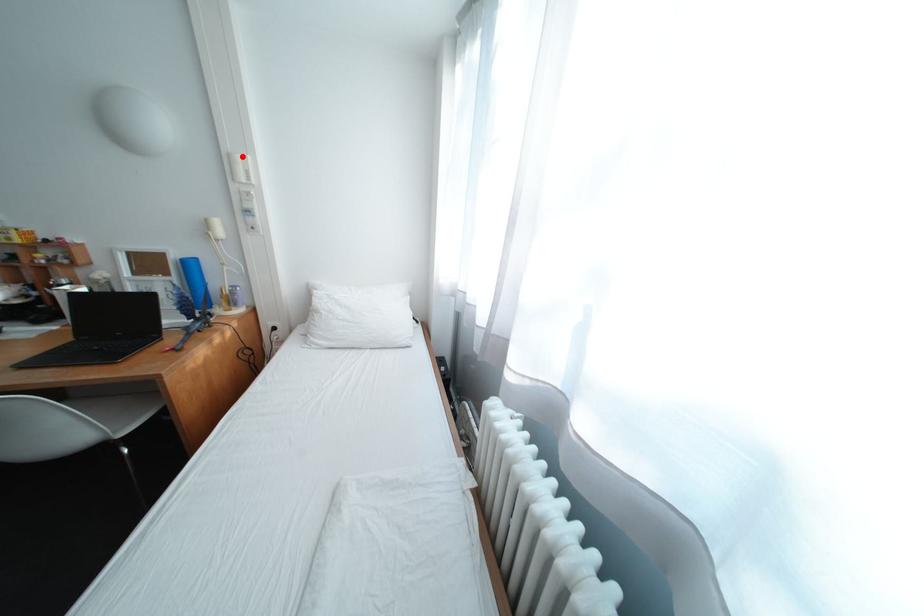
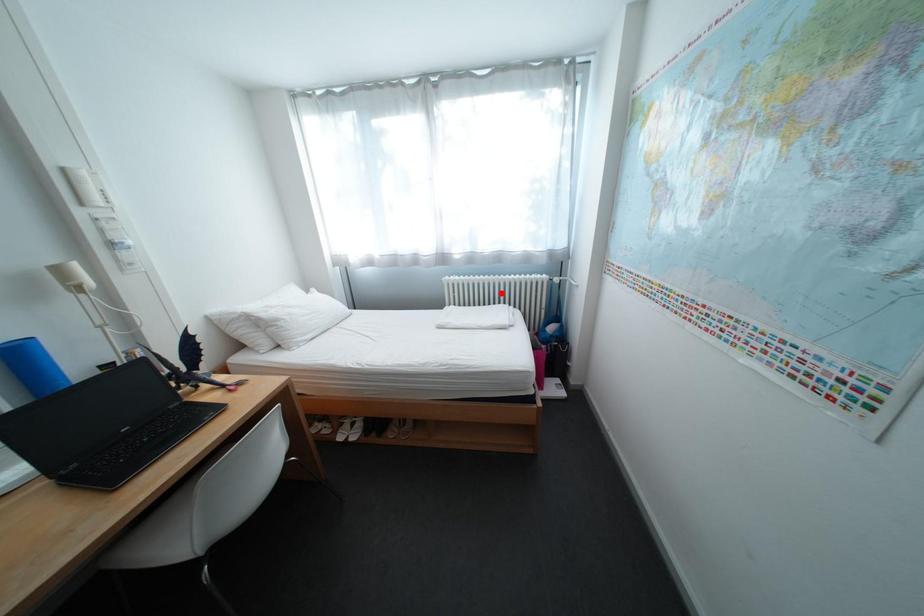
I am providing you with two images of the same scene from different viewpoints. A red point is marked on the first image and another point is marked on the second image. Do the highlighted points in image1 and image2 indicate the same real-world spot?

No